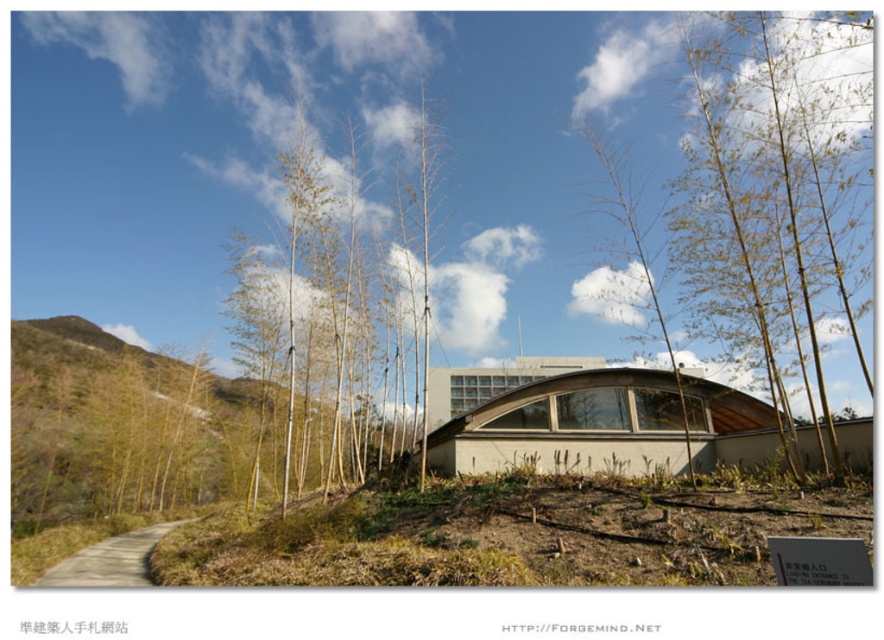
Who is positioned more to the right, brown dirt path at lower left or brown wood tree at center?

Positioned to the right is brown wood tree at center.

Is point (136, 570) positioned behind point (686, 445)?

That is False.

Where is `brown dirt path at lower left`? The image size is (884, 640). brown dirt path at lower left is located at coordinates (111, 560).

Is the position of yellow-green bamboo at center more distant than that of smooth white bamboo at center?

No, yellow-green bamboo at center is closer to the viewer.

Who is positioned more to the left, yellow-green bamboo at center or smooth white bamboo at center?

smooth white bamboo at center

Who is more distant from viewer, (865, 90) or (272, 376)?

The point (272, 376) is more distant.

This screenshot has width=884, height=640. I want to click on yellow-green bamboo at center, so click(x=774, y=184).

Is yellow-green bamboo at center shorter than brown dirt path at lower left?

Yes.

Is point (682, 33) behind point (134, 561)?

Yes.

The width and height of the screenshot is (884, 640). Identify the location of yellow-green bamboo at center. (774, 184).